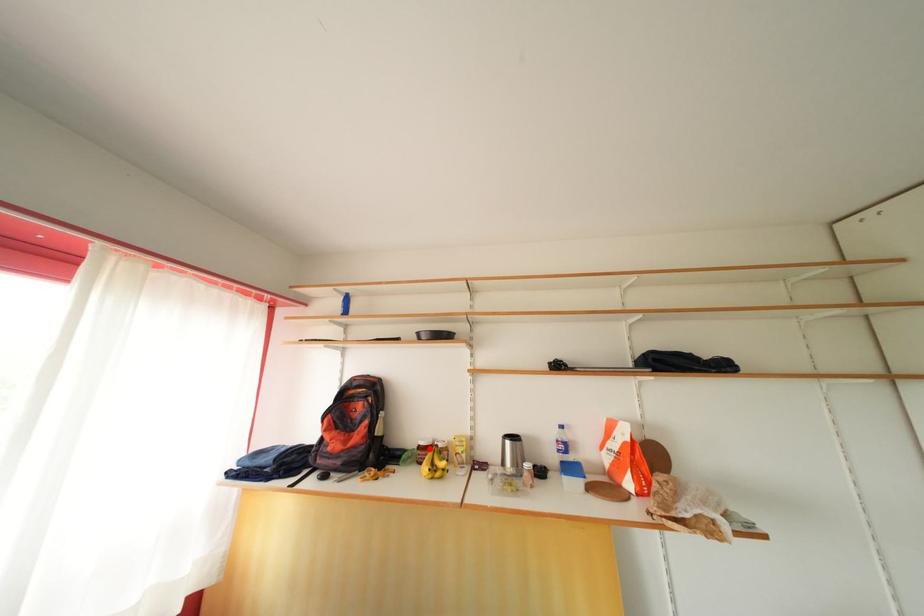
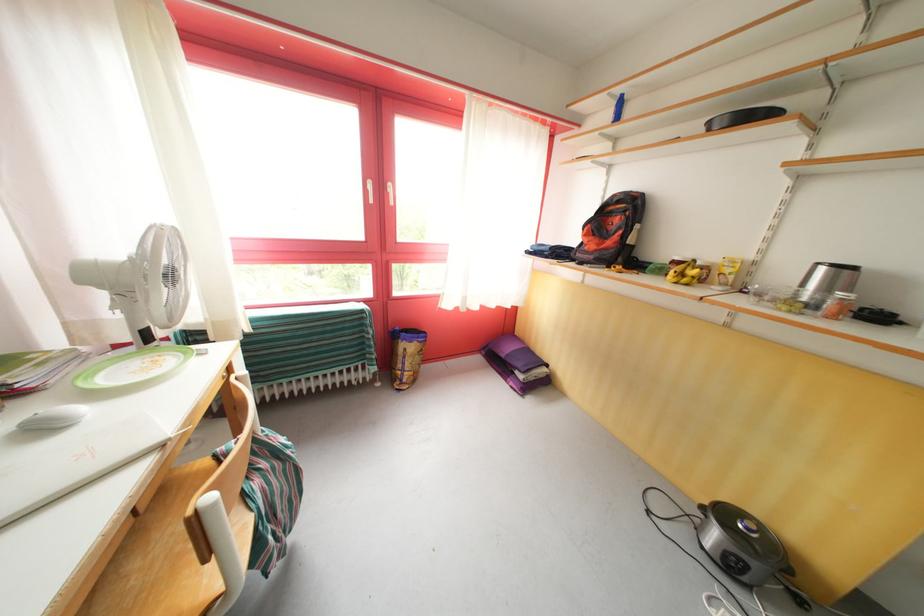
The point at the highlighted location is marked in the first image. Where is the corresponding point in the second image?

(684, 264)